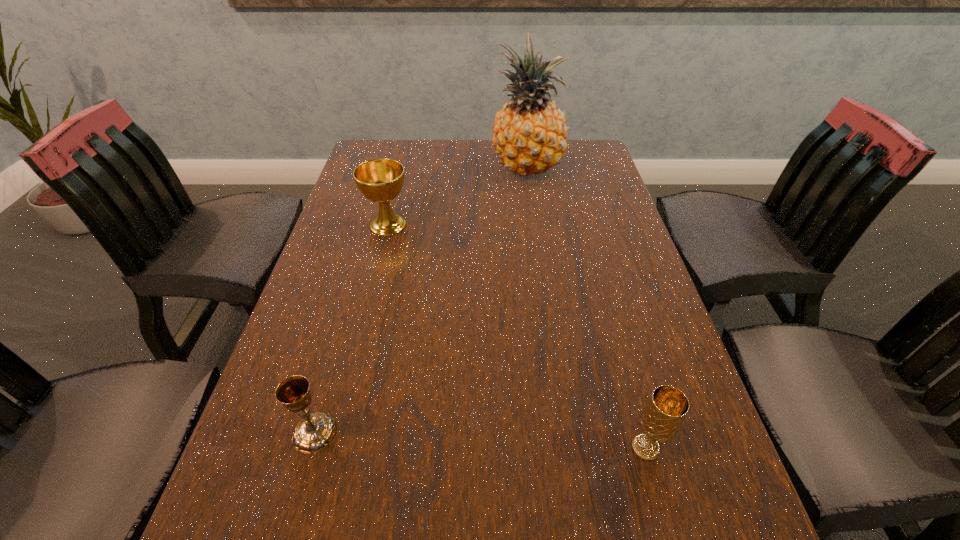
I want to click on object at the far right corner, so click(x=529, y=135).

This screenshot has width=960, height=540. I want to click on free space at the far edge of the desktop, so click(444, 143).

Where is `free space at the left edge`? Image resolution: width=960 pixels, height=540 pixels. free space at the left edge is located at coordinates (328, 510).

Locate an element on the screen. This screenshot has height=540, width=960. blank space at the right edge of the desktop is located at coordinates (647, 504).

You are a GUI agent. You are given a task and a screenshot of the screen. Output one action in this format:
    pyautogui.click(x=<x>, y=<y>)
    Task: Click on the free point between the third nearest object and the pineapple
    This screenshot has height=540, width=960.
    Given the screenshot: What is the action you would take?
    pyautogui.click(x=457, y=196)

Where is `vacant space that's between the rightmost chalice and the tallest object`? The image size is (960, 540). vacant space that's between the rightmost chalice and the tallest object is located at coordinates [587, 308].

Find the location of `vacant space that is in between the farthest chalice and the rightmost chalice`. vacant space that is in between the farthest chalice and the rightmost chalice is located at coordinates (516, 336).

You are a GUI agent. You are given a task and a screenshot of the screen. Output one action in this format:
    pyautogui.click(x=<x>, y=<y>)
    Task: Click on the free space between the rightmost chalice and the farthest chalice
    
    Given the screenshot: What is the action you would take?
    pyautogui.click(x=516, y=336)

Where is `object that can be found as the second closest to the third nearest object`? object that can be found as the second closest to the third nearest object is located at coordinates (314, 433).

The width and height of the screenshot is (960, 540). Identify the location of the closest object to the farthest chalice. (529, 135).